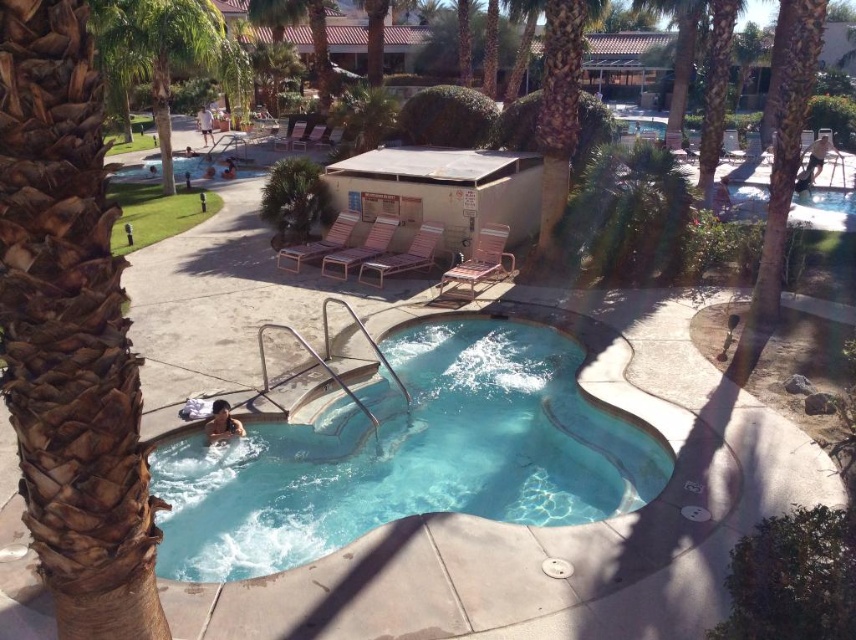
Question: Which of the following is the closest to the observer?

Choices:
 (A) (197, 113)
 (B) (153, 3)
 (C) (34, 177)
 (D) (183, 554)

Answer: (C)

Question: Among these points, which one is farthest from the camera?

Choices:
 (A) (28, 10)
 (B) (187, 38)

Answer: (B)

Question: Observing the image, what is the correct spatial positioning of brown textured palm tree at left in reference to tan shorts at center?

Choices:
 (A) below
 (B) above

Answer: (A)

Question: Which point is closer to the camera taking this photo?

Choices:
 (A) (137, 24)
 (B) (207, 113)

Answer: (A)

Question: Can you confirm if brown textured palm tree at left is smaller than brown textured palm tree at center?

Choices:
 (A) no
 (B) yes

Answer: (B)

Question: Is smooth skin person at lower left positioned in front of tan shorts at center?

Choices:
 (A) yes
 (B) no

Answer: (A)